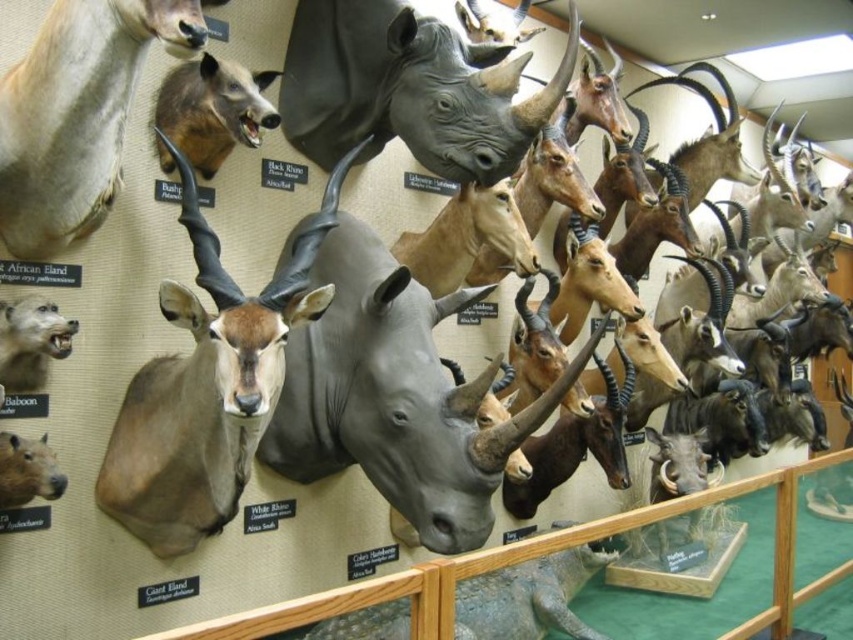
You are an art curator examining the mounted animal heads in the museum display. You notice two rhinoceros heads labeled as matte gray rhinoceros at center and black matte rhinoceros at center. Which one is positioned to the left side of the other?

The matte gray rhinoceros at center is positioned to the left of the black matte rhinoceros at center.

Based on the photo, you are standing in front of the display of taxidermied animal heads. You notice two rhinoceros heads labeled as matte gray rhinoceros at center and black matte rhinoceros at center. Which one appears closer to you?

The matte gray rhinoceros at center appears closer to the viewer than the black matte rhinoceros at center.